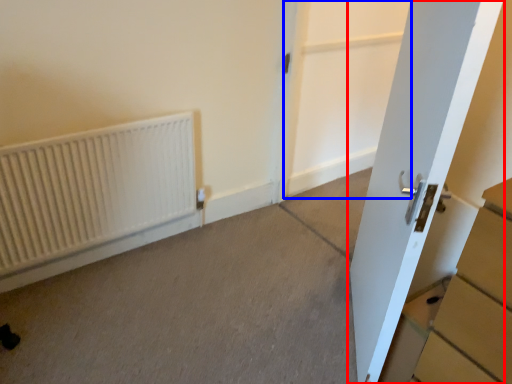
Question: Which object is closer to the camera taking this photo, door (highlighted by a red box) or screen door (highlighted by a blue box)?

Choices:
 (A) door
 (B) screen door

Answer: (A)